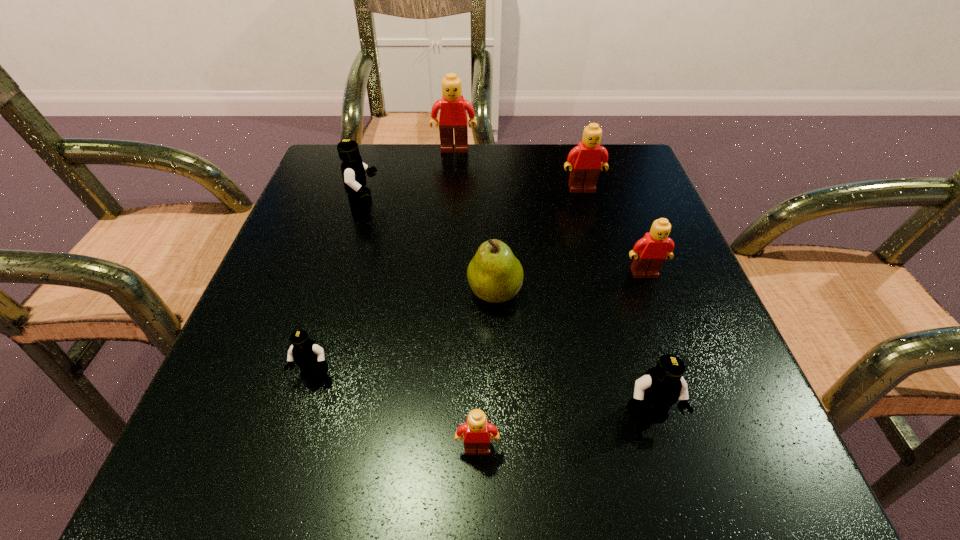
Where is `the fifth farthest Lego`? the fifth farthest Lego is located at coordinates (309, 357).

Find the location of a particular element. The image size is (960, 540). the nearest brown Lego is located at coordinates (477, 430).

The height and width of the screenshot is (540, 960). What are the coordinates of `the nearest Lego` in the screenshot? It's located at (477, 430).

Where is `vacant position located 0.230m on the face of the farthest brown Lego`? The width and height of the screenshot is (960, 540). vacant position located 0.230m on the face of the farthest brown Lego is located at coordinates (449, 213).

This screenshot has width=960, height=540. In order to click on free spot located on the front-facing side of the farthest black Lego in this screenshot , I will do `click(508, 206)`.

This screenshot has height=540, width=960. In order to click on vacant region located 0.070m on the face of the third smallest brown Lego in this screenshot , I will do `click(588, 214)`.

Find the location of a particular element. The width and height of the screenshot is (960, 540). vacant area situated 0.180m on the right of the pear is located at coordinates (628, 293).

You are a GUI agent. You are given a task and a screenshot of the screen. Output one action in this format:
    pyautogui.click(x=<x>, y=<y>)
    Task: Click on the vacant region located 0.110m on the face of the third biggest brown Lego
    The width and height of the screenshot is (960, 540).
    Given the screenshot: What is the action you would take?
    pyautogui.click(x=664, y=330)

Where is `free spot located on the front-facing side of the smallest black Lego`? free spot located on the front-facing side of the smallest black Lego is located at coordinates (295, 439).

In order to click on object that is at the far left corner in this screenshot , I will do `click(353, 169)`.